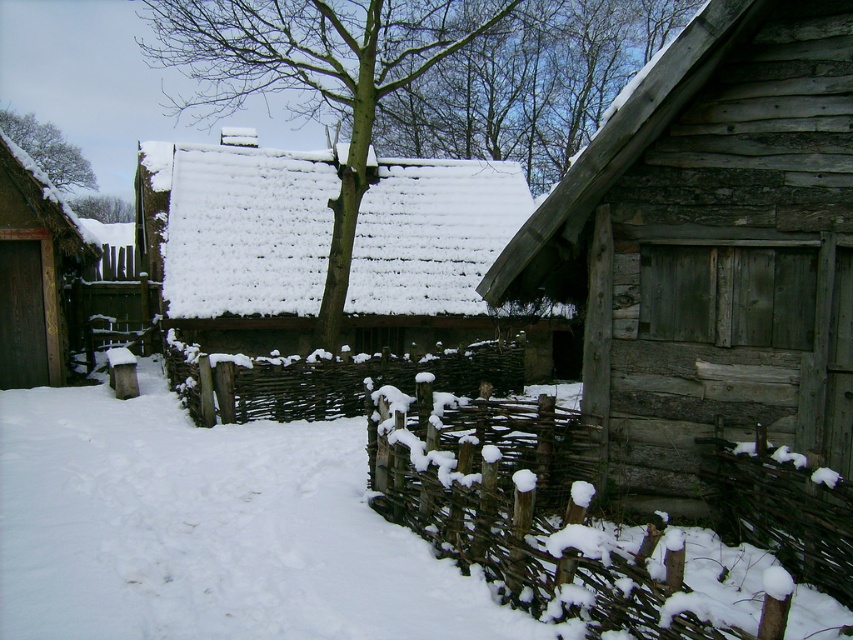
From the picture: You are an artist trying to sketch the winter scene. You want to ensure the green textured tree at center and the brown wooden fence at lower right are proportionally accurate. Which object should you draw first to maintain proper scale, and why?

You should draw the green textured tree at center first because it is larger in size than the brown wooden fence at lower right. Starting with the larger object helps establish the correct scale for the smaller one.

You are an artist planning to paint the winter scene. You want to ensure the green textured tree at center and the brown wooden fence at lower right are proportionally accurate. Which object should you make wider in your painting?

The green textured tree at center should be made wider in the painting since it might be wider than the brown wooden fence at lower right according to the description.